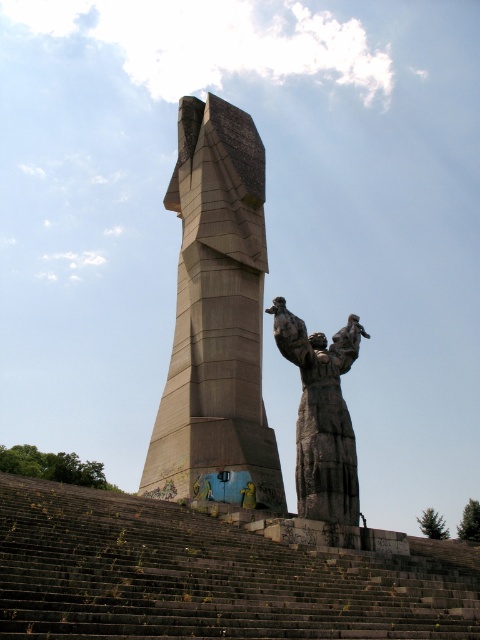
You are standing in front of the sculpture and want to place a small flower pot between the dark gray stone stairs at center and the gray stone statue at center. Based on their positions, where should you place the flower pot to ensure it is between them?

The dark gray stone stairs at center is located below the gray stone statue at center, so placing the flower pot between them would require positioning it below the statue and above the stairs.

You are standing in front of the sculpture and want to take a photo of both the dark gray stone stairs at center and the rough stone statue at center. Which object should you focus on first to ensure both are in the frame?

You should focus on the dark gray stone stairs at center first since it is closer to the viewer, allowing the rough stone statue at center to stay in the frame as well.